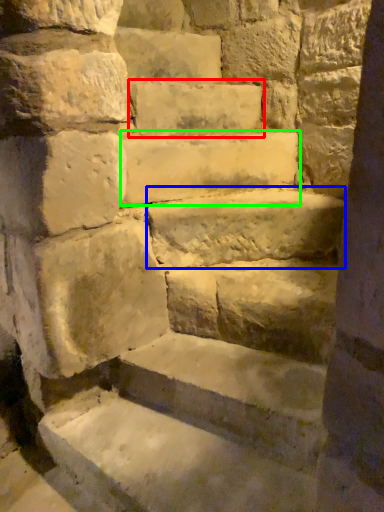
Question: Which object is the farthest from brick (highlighted by a red box)? Choose among these: limestone (highlighted by a blue box) or stone (highlighted by a green box).

Choices:
 (A) limestone
 (B) stone

Answer: (A)